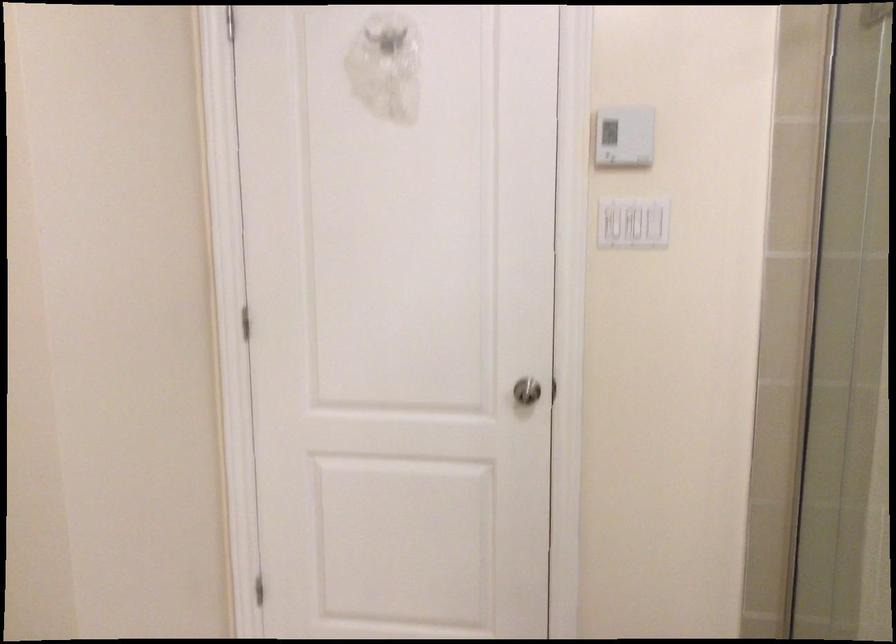
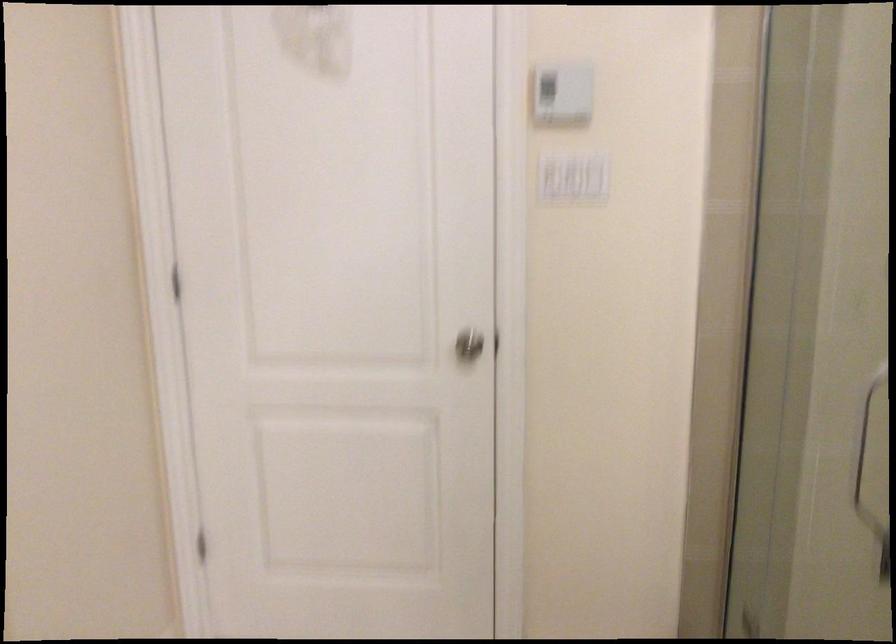
Question: The camera is either moving clockwise (left) or counter-clockwise (right) around the object. The first image is from the beginning of the video and the second image is from the end. Is the camera moving left or right when shooting the video?

Choices:
 (A) Left
 (B) Right

Answer: (A)